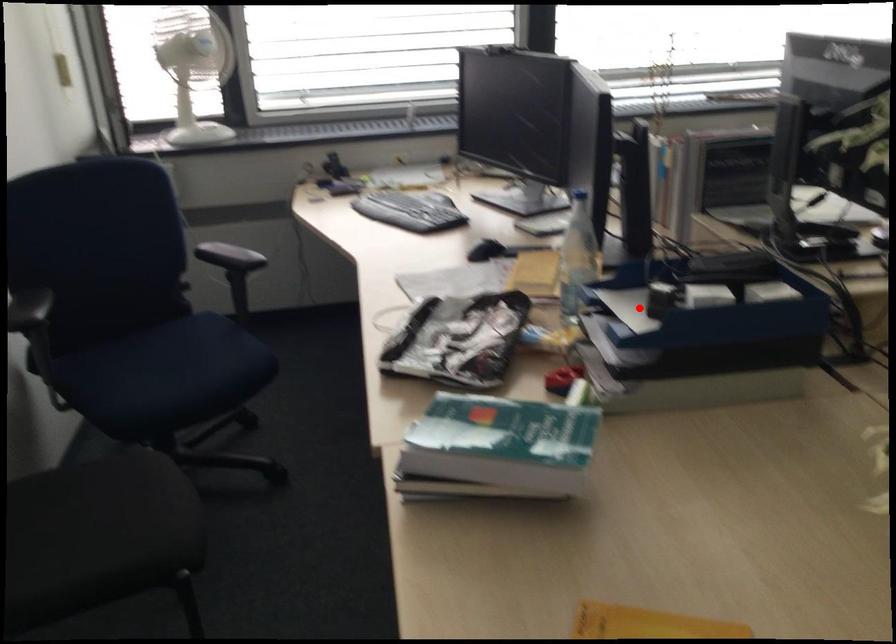
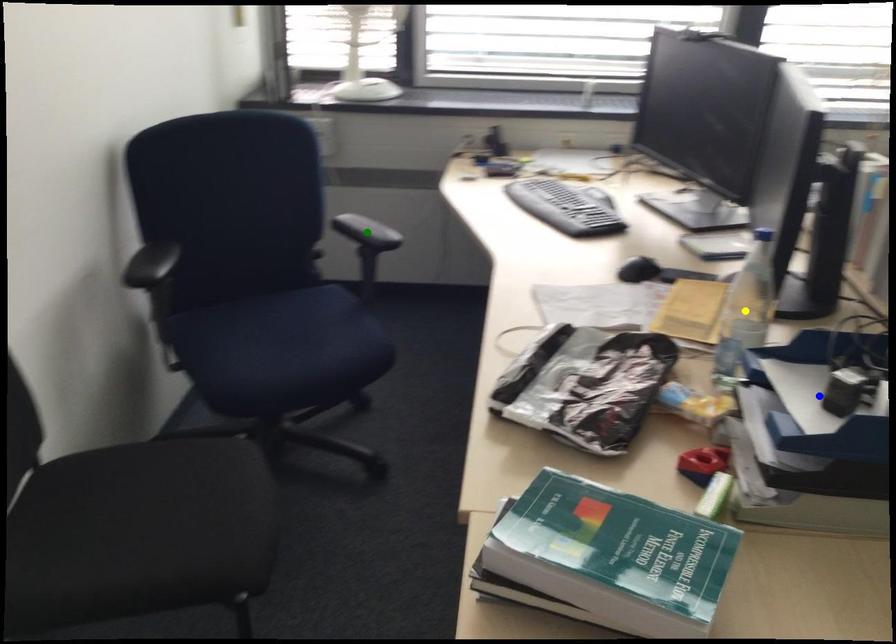
Question: I am providing you with two images of the same scene from different viewpoints. A red point is marked on the first image. You are given multiple points on the second image. In image 2, which mark is for the same physical point as the one in image 1?

Choices:
 (A) blue point
 (B) yellow point
 (C) green point

Answer: (A)